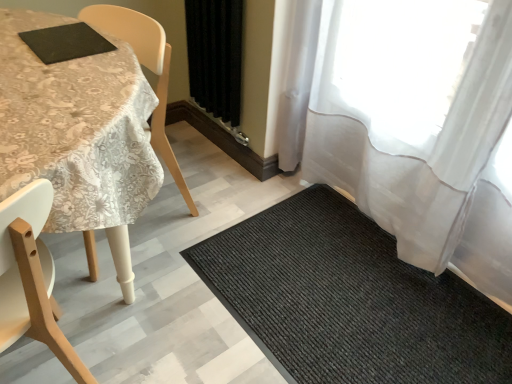
Question: Based on their sizes in the image, would you say black textured mat at lower right is bigger or smaller than white lace tablecloth at upper left?

Choices:
 (A) big
 (B) small

Answer: (B)

Question: Is black textured mat at lower right in front of or behind white lace tablecloth at upper left in the image?

Choices:
 (A) behind
 (B) front

Answer: (A)

Question: Based on their relative distances, which object is farther from the wooden chair at left?

Choices:
 (A) black fabric curtain at center, positioned as the first curtain in left-to-right order
 (B) black textured mat at lower right
 (C) white lace tablecloth at upper left
 (D) sheer white curtain at right, the first curtain viewed from the right

Answer: (A)

Question: Based on their relative distances, which object is farther from the white lace tablecloth at upper left?

Choices:
 (A) wooden chair at left
 (B) black textured mat at lower right
 (C) black fabric curtain at center, positioned as the first curtain in left-to-right order
 (D) sheer white curtain at right, placed as the 2th curtain when sorted from left to right

Answer: (D)